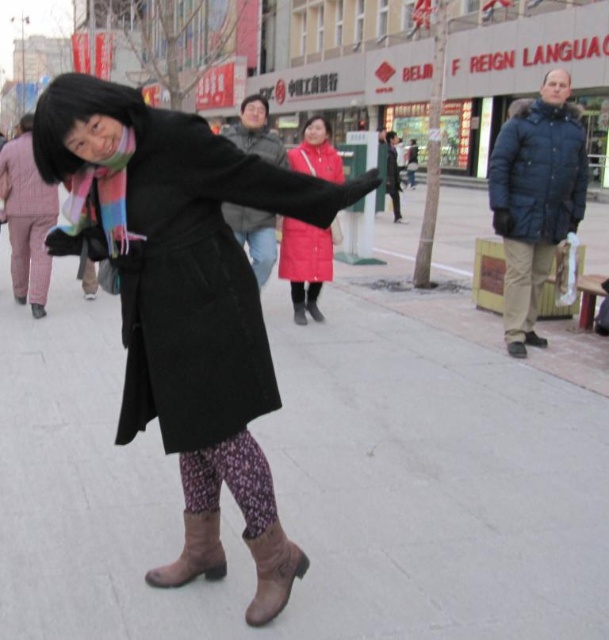
Please provide the 2D coordinates of the matte black coat at center in the image. The coordinates should be in the format of a point with two decimal places, such as 0.12,0.34.

The 2D coordinates of the matte black coat at center are at point (x=181, y=273).